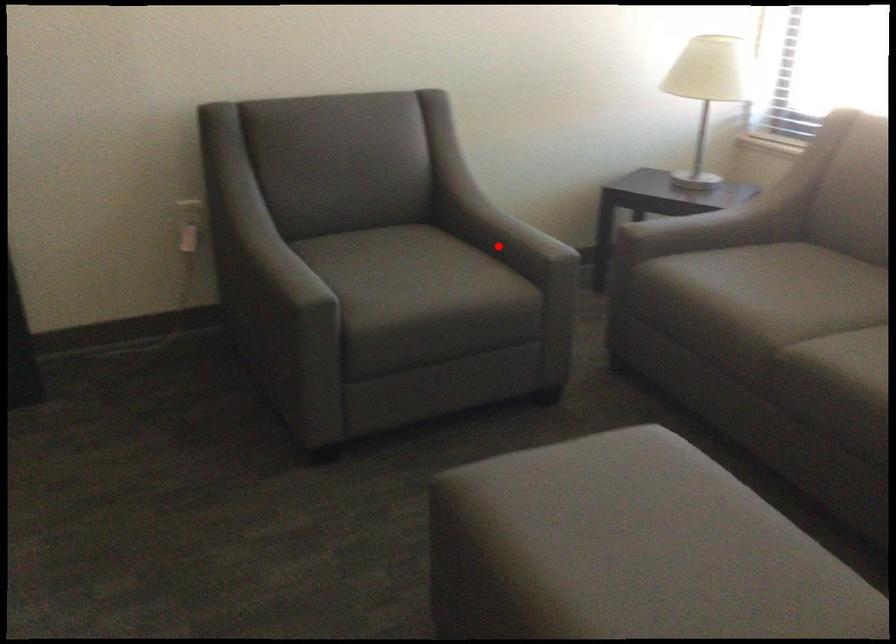
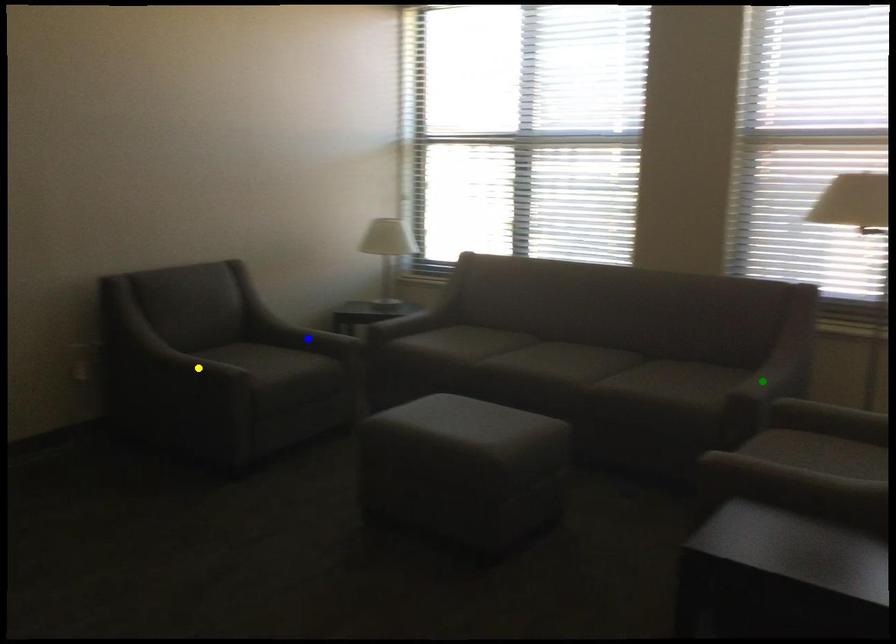
Question: I am providing you with two images of the same scene from different viewpoints. A red point is marked on the first image. You are given multiple points on the second image. Which point in image 2 is actually the same real-world point as the red point in image 1?

Choices:
 (A) green point
 (B) yellow point
 (C) blue point

Answer: (C)